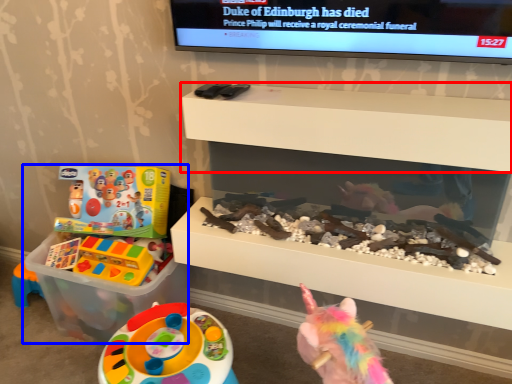
Question: Which object is closer to the camera taking this photo, shelf (highlighted by a red box) or toy (highlighted by a blue box)?

Choices:
 (A) shelf
 (B) toy

Answer: (A)